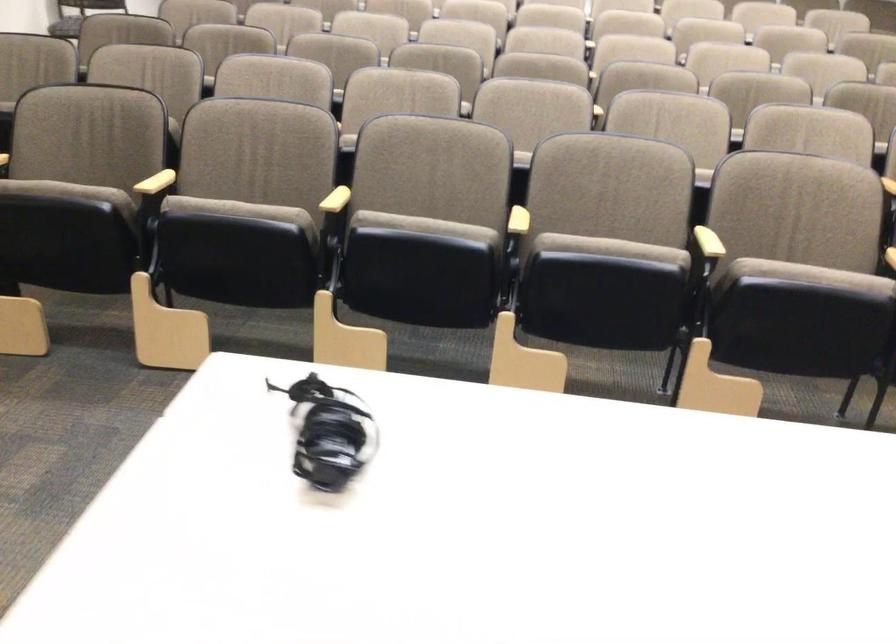
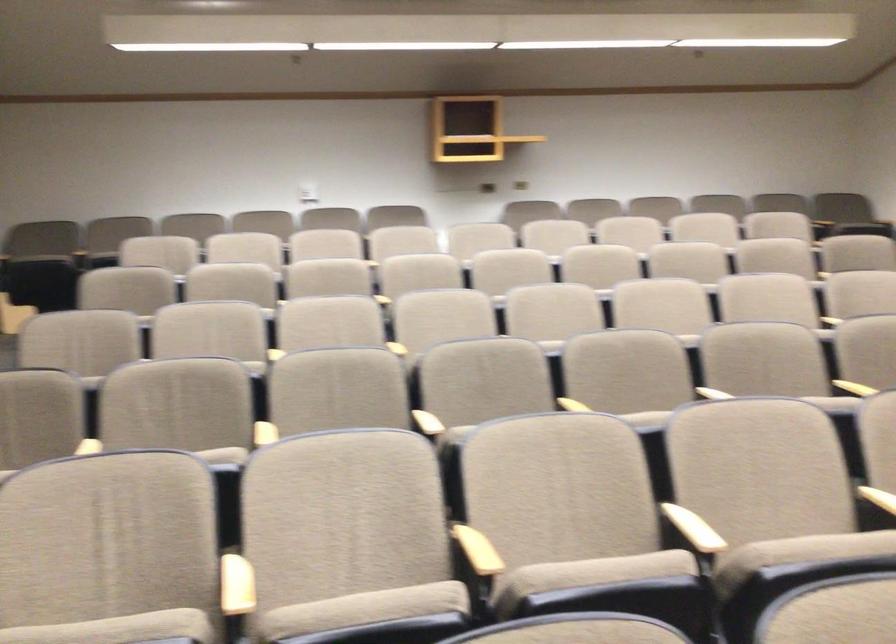
Where in the second image is the point corresponding to point 192,90 from the first image?

(236, 585)